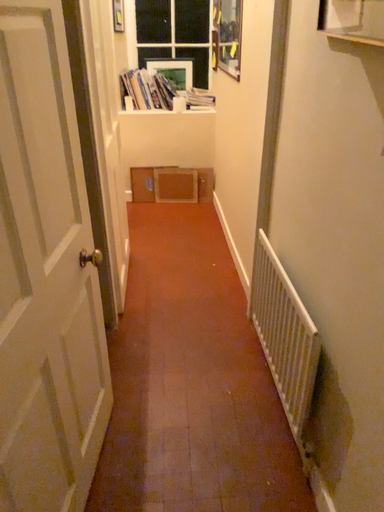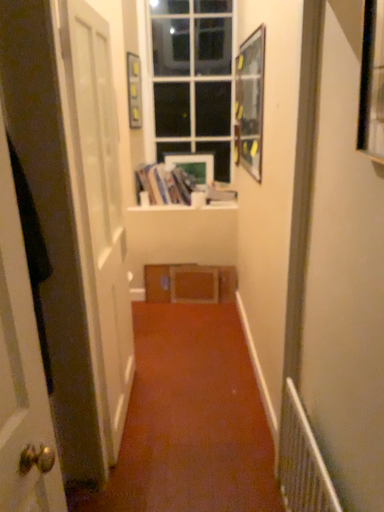
Question: Which way did the camera rotate in the video?

Choices:
 (A) rotated downward
 (B) rotated upward

Answer: (B)